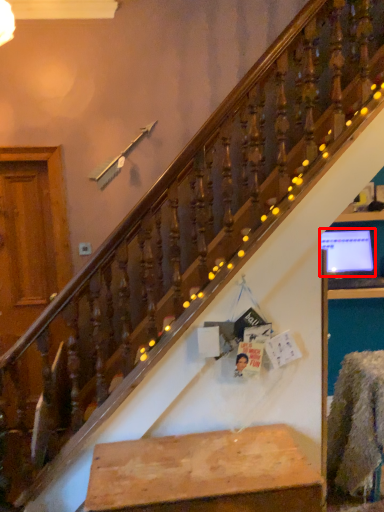
Question: From the image's perspective, considering the relative positions of computer monitor (annotated by the red box) and furniture in the image provided, where is computer monitor (annotated by the red box) located with respect to the staircase?

Choices:
 (A) above
 (B) below

Answer: (A)